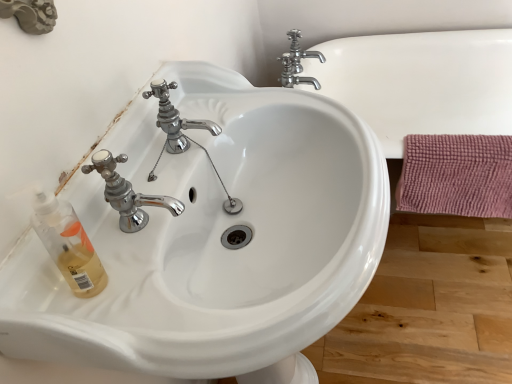
Describe the element at coordinates (456, 175) in the screenshot. I see `pink textured bath towel at right` at that location.

Measure the distance between pink textured bath towel at right and camera.

Result: 1.03 meters.

What do you see at coordinates (212, 238) in the screenshot? I see `white glossy sink at center` at bounding box center [212, 238].

Where is `white glossy sink at center`? This screenshot has height=384, width=512. white glossy sink at center is located at coordinates (212, 238).

The height and width of the screenshot is (384, 512). What are the coordinates of `polished chrome faucet at upper center, which is the 2th tap in right-to-left order` in the screenshot? It's located at 175,118.

Is point (176, 109) in front of point (495, 192)?

Yes, point (176, 109) is in front of point (495, 192).

Considering the relative sizes of polished chrome faucet at upper center, which is the 2th tap in right-to-left order, and pink textured bath towel at right in the image provided, is polished chrome faucet at upper center, which is the 2th tap in right-to-left order, bigger than pink textured bath towel at right?

No.

At what (x,y) coordinates should I click in order to perform the action: click on the 2nd tap to the left when counting from the pink textured bath towel at right. Please return your answer as a coordinate pair (x, y). This screenshot has width=512, height=384. Looking at the image, I should click on (175, 118).

Could pink textured bath towel at right be considered to be inside polished chrome faucet at upper center, marked as the first tap in a bottom-to-top arrangement?

No, pink textured bath towel at right is located outside of polished chrome faucet at upper center, marked as the first tap in a bottom-to-top arrangement.

From the picture: Does chrome metallic faucet at upper center, which ranks as the second tap in front-to-back order, contain pink textured bath towel at right?

No, pink textured bath towel at right is not inside chrome metallic faucet at upper center, which ranks as the second tap in front-to-back order.

From the image's perspective, who appears lower, chrome metallic faucet at upper center, positioned as the second tap in left-to-right order, or pink textured bath towel at right?

pink textured bath towel at right is shown below in the image.

Does point (293, 61) come in front of point (447, 202)?

That is False.

Who is shorter, polished chrome faucet at upper center, marked as the first tap in a bottom-to-top arrangement, or chrome metallic faucet at upper center, marked as the first tap in a top-to-bottom arrangement?

chrome metallic faucet at upper center, marked as the first tap in a top-to-bottom arrangement.

Between polished chrome faucet at upper center, which is the 2th tap in right-to-left order, and chrome metallic faucet at upper center, positioned as the second tap in left-to-right order, which one is positioned behind?

Positioned behind is chrome metallic faucet at upper center, positioned as the second tap in left-to-right order.

Which is closer, (160, 121) or (295, 49)?

The point (160, 121) is in front.

Based on the photo, considering the sizes of objects polished chrome faucet at upper center, the 2th tap from the back, and chrome metallic faucet at upper center, the first tap from the back, in the image provided, who is thinner, polished chrome faucet at upper center, the 2th tap from the back, or chrome metallic faucet at upper center, the first tap from the back,?

With smaller width is polished chrome faucet at upper center, the 2th tap from the back.

Is polished chrome faucet at upper center, marked as the 2th tap in a top-to-bottom arrangement, far from white glossy sink at center?

polished chrome faucet at upper center, marked as the 2th tap in a top-to-bottom arrangement, is actually quite close to white glossy sink at center.

Is polished chrome faucet at upper center, marked as the first tap in a bottom-to-top arrangement, oriented away from white glossy sink at center?

No, white glossy sink at center is not at the back of polished chrome faucet at upper center, marked as the first tap in a bottom-to-top arrangement.

From the picture: Between polished chrome faucet at upper center, which is the 1th tap in front-to-back order, and white glossy sink at center, which one appears on the right side from the viewer's perspective?

white glossy sink at center is more to the right.

Looking at this image, considering the relative sizes of polished chrome faucet at upper center, which is the 2th tap in right-to-left order, and white glossy sink at center in the image provided, is polished chrome faucet at upper center, which is the 2th tap in right-to-left order, thinner than white glossy sink at center?

Indeed, polished chrome faucet at upper center, which is the 2th tap in right-to-left order, has a lesser width compared to white glossy sink at center.

From a real-world perspective, starting from the pink textured bath towel at right, which tap is the 1st one vertically above it? Please provide its 2D coordinates.

[(297, 63)]

Which of these two, pink textured bath towel at right or chrome metallic faucet at upper center, the second tap from the bottom, is wider?

With larger width is chrome metallic faucet at upper center, the second tap from the bottom.

Based on the photo, could you measure the distance between pink textured bath towel at right and chrome metallic faucet at upper center, the second tap from the bottom?

The distance of pink textured bath towel at right from chrome metallic faucet at upper center, the second tap from the bottom, is 22.75 inches.

Is pink textured bath towel at right closer to camera compared to chrome metallic faucet at upper center, positioned as the second tap in left-to-right order?

That is True.

From the picture: Considering the relative sizes of white glossy sink at center and polished chrome faucet at upper center, marked as the 2th tap in a top-to-bottom arrangement, in the image provided, is white glossy sink at center bigger than polished chrome faucet at upper center, marked as the 2th tap in a top-to-bottom arrangement,?

Indeed, white glossy sink at center has a larger size compared to polished chrome faucet at upper center, marked as the 2th tap in a top-to-bottom arrangement.

Locate an element on the screen. Image resolution: width=512 pixels, height=384 pixels. sink on the right side of polished chrome faucet at upper center, the 2th tap from the back is located at coordinates (212, 238).

From a real-world perspective, is white glossy sink at center on top of polished chrome faucet at upper center, which is the 1th tap in front-to-back order?

Actually, white glossy sink at center is physically below polished chrome faucet at upper center, which is the 1th tap in front-to-back order, in the real world.

Who is smaller, pink textured bath towel at right or polished chrome faucet at upper center, which is the 2th tap in right-to-left order?

polished chrome faucet at upper center, which is the 2th tap in right-to-left order, is smaller.

From a real-world perspective, is pink textured bath towel at right over polished chrome faucet at upper center, which is the 1th tap in front-to-back order?

No.

Is pink textured bath towel at right aimed at polished chrome faucet at upper center, the 2th tap from the back?

No, pink textured bath towel at right is not oriented towards polished chrome faucet at upper center, the 2th tap from the back.

Does pink textured bath towel at right come behind polished chrome faucet at upper center, which is the first tap in left-to-right order?

Yes, pink textured bath towel at right is behind polished chrome faucet at upper center, which is the first tap in left-to-right order.

Identify the location of tap that appears in front of the pink textured bath towel at right. (175, 118).

From the image's perspective, which tap is the 2nd one above the pink textured bath towel at right? Please provide its 2D coordinates.

[(297, 63)]

Which object lies nearer to the anchor point pink textured bath towel at right, chrome metallic faucet at upper center, which ranks as the first tap in right-to-left order, or polished chrome faucet at upper center, marked as the first tap in a bottom-to-top arrangement?

The object closer to pink textured bath towel at right is chrome metallic faucet at upper center, which ranks as the first tap in right-to-left order.

Considering their positions, is polished chrome faucet at upper center, which is the first tap in left-to-right order, positioned further to chrome metallic faucet at upper center, the second tap from the bottom, than white glossy sink at center?

The object further to chrome metallic faucet at upper center, the second tap from the bottom, is white glossy sink at center.

Looking at the image, which one is located closer to chrome metallic faucet at upper center, marked as the first tap in a top-to-bottom arrangement, polished chrome faucet at upper center, which is the first tap in left-to-right order, or pink textured bath towel at right?

pink textured bath towel at right is positioned closer to the anchor chrome metallic faucet at upper center, marked as the first tap in a top-to-bottom arrangement.

Estimate the real-world distances between objects in this image. Which object is further from pink textured bath towel at right, chrome metallic faucet at upper center, which ranks as the first tap in right-to-left order, or white glossy sink at center?

chrome metallic faucet at upper center, which ranks as the first tap in right-to-left order, lies further to pink textured bath towel at right than the other object.

Looking at the image, which one is located closer to pink textured bath towel at right, polished chrome faucet at upper center, marked as the 2th tap in a top-to-bottom arrangement, or chrome metallic faucet at upper center, marked as the first tap in a top-to-bottom arrangement?

chrome metallic faucet at upper center, marked as the first tap in a top-to-bottom arrangement, lies closer to pink textured bath towel at right than the other object.

Considering their positions, is chrome metallic faucet at upper center, positioned as the second tap in left-to-right order, positioned further to polished chrome faucet at upper center, the 2th tap from the back, than white glossy sink at center?

The object further to polished chrome faucet at upper center, the 2th tap from the back, is chrome metallic faucet at upper center, positioned as the second tap in left-to-right order.

When comparing their distances from polished chrome faucet at upper center, marked as the first tap in a bottom-to-top arrangement, does pink textured bath towel at right or chrome metallic faucet at upper center, positioned as the second tap in left-to-right order, seem closer?

The object closer to polished chrome faucet at upper center, marked as the first tap in a bottom-to-top arrangement, is pink textured bath towel at right.

Which object lies nearer to the anchor point white glossy sink at center, pink textured bath towel at right or chrome metallic faucet at upper center, the second tap from the bottom?

The object closer to white glossy sink at center is pink textured bath towel at right.

Locate an element on the screen. bath towel between polished chrome faucet at upper center, which is the 1th tap in front-to-back order, and chrome metallic faucet at upper center, positioned as the second tap in left-to-right order, along the z-axis is located at coordinates (456, 175).

Image resolution: width=512 pixels, height=384 pixels. I want to click on bath towel between white glossy sink at center and chrome metallic faucet at upper center, the second tap from the bottom, from front to back, so coord(456,175).

The height and width of the screenshot is (384, 512). Identify the location of tap between white glossy sink at center and chrome metallic faucet at upper center, which ranks as the first tap in right-to-left order, along the z-axis. (175, 118).

At what (x,y) coordinates should I click in order to perform the action: click on sink located between polished chrome faucet at upper center, which is the 2th tap in right-to-left order, and pink textured bath towel at right in the left-right direction. Please return your answer as a coordinate pair (x, y). The image size is (512, 384). Looking at the image, I should click on (212, 238).